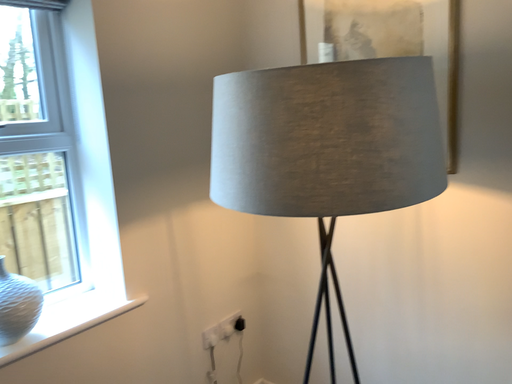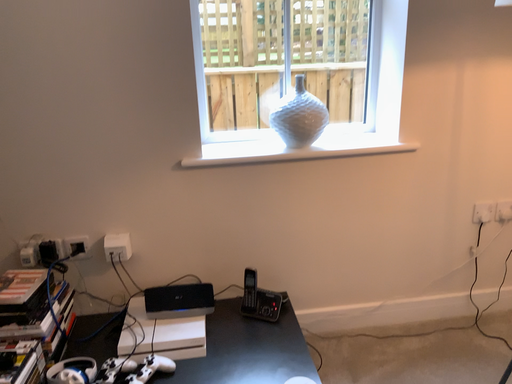
Question: Which way did the camera rotate in the video?

Choices:
 (A) rotated left
 (B) rotated right

Answer: (A)